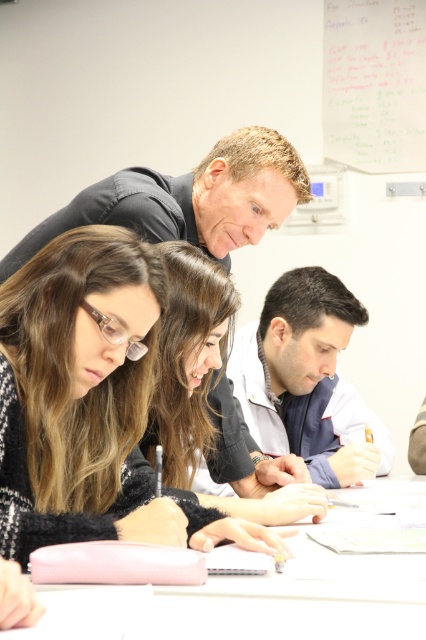
Does white fabric shirt at lower right appear on the left side of whiteboard at upper right?

Yes, white fabric shirt at lower right is to the left of whiteboard at upper right.

Identify the location of white fabric shirt at lower right. The width and height of the screenshot is (426, 640). (307, 380).

Where is `white fabric shirt at lower right`? white fabric shirt at lower right is located at coordinates (307, 380).

Consider the image. Does black sweater at lower left have a smaller size compared to smooth black hair at center?

Indeed, black sweater at lower left has a smaller size compared to smooth black hair at center.

Who is more distant from viewer, (x=65, y=499) or (x=193, y=250)?

The point (x=193, y=250) is behind.

Who is more forward, (91, 230) or (293, 499)?

Positioned in front is point (91, 230).

Where is `black sweater at lower left`? The width and height of the screenshot is (426, 640). black sweater at lower left is located at coordinates (77, 392).

Between white matte table at lower center and smooth black hair at center, which one is positioned higher?

smooth black hair at center

Is point (83, 605) positioned after point (199, 380)?

No, it is not.

Is point (201, 595) in front of point (180, 419)?

Yes.

In order to click on white matte table at lower center in this screenshot , I will do `click(250, 604)`.